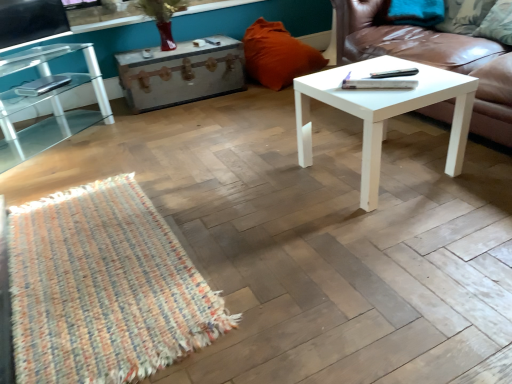
This screenshot has height=384, width=512. I want to click on vacant space underneath white matte coffee table at center (from a real-world perspective), so click(x=388, y=170).